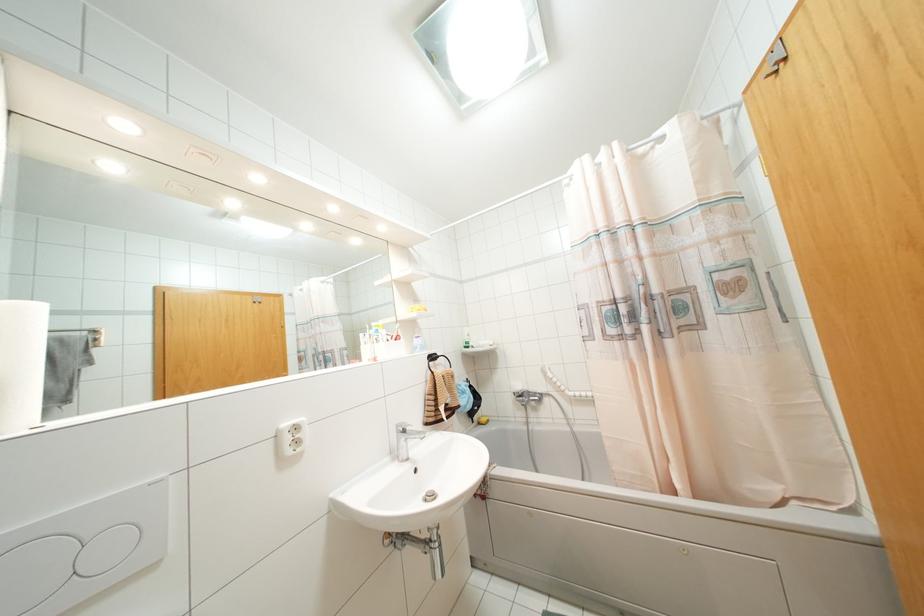
Identify the location of silver shower head. (520, 395).